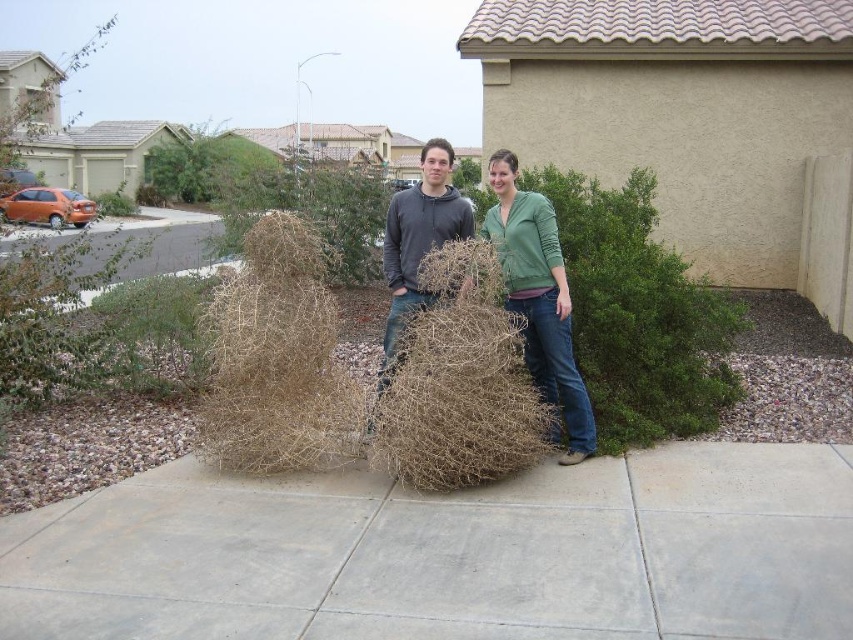
You are standing at the origin point in the image. The brown textured tumbleweed at center is located at coordinates given in the description. If you want to walk directly to the tumbleweed, which direction should you move in relation to your current position?

Answer: The brown textured tumbleweed at center is located at coordinates point (538, 298), so you should move towards the northeast direction to reach it.

You are standing at the edge of the gray concrete pavement at center and want to take a photo of the beige stucco house with your smartphone, which has a maximum focus range of 2.5 meters. Can you capture the house clearly without moving closer?

The gray concrete pavement at center is 3.07 meters away from camera, which exceeds the smartphone camera maximum focus range of 2.5 meters. Therefore, the house cannot be captured clearly without moving closer.

You are standing in front of the beige stucco house with a tiled roof and see the point marked at coordinates (277, 360). What object is located at that point?

The point at (277, 360) marks dry straw at center.